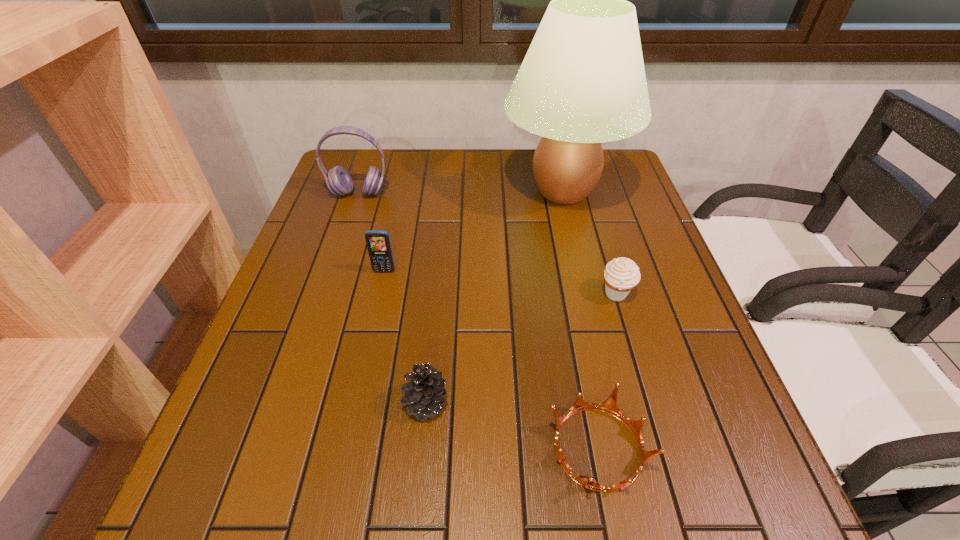
Where is `lampshade that is at the right edge`? The image size is (960, 540). lampshade that is at the right edge is located at coordinates (582, 82).

Locate an element on the screen. This screenshot has width=960, height=540. muffin that is at the right edge is located at coordinates (621, 276).

The width and height of the screenshot is (960, 540). Identify the location of object situated at the far left corner. (338, 180).

In order to click on object present at the far right corner in this screenshot , I will do `click(582, 82)`.

The width and height of the screenshot is (960, 540). In the image, there is a desktop. Identify the location of vacant space at the far edge. (496, 169).

The height and width of the screenshot is (540, 960). In the image, there is a desktop. In order to click on vacant space at the near edge in this screenshot , I will do `click(646, 521)`.

At what (x,y) coordinates should I click in order to perform the action: click on free space at the left edge. Please return your answer as a coordinate pair (x, y). The image size is (960, 540). Looking at the image, I should click on (352, 203).

Locate an element on the screen. The image size is (960, 540). vacant space at the right edge of the desktop is located at coordinates (651, 425).

In the image, there is a desktop. Identify the location of vacant space at the near left corner. (265, 501).

Identify the location of vacant region at the far right corner of the desktop. (616, 188).